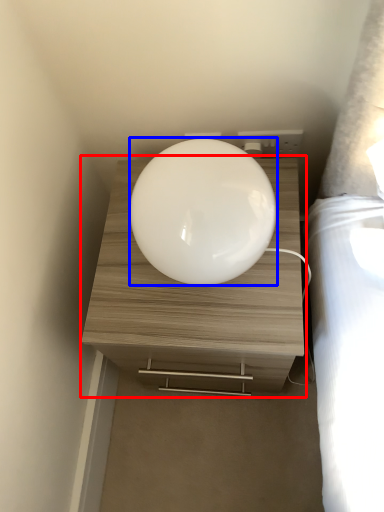
Question: Which point is further to the camera, nightstand (highlighted by a red box) or oval (highlighted by a blue box)?

Choices:
 (A) nightstand
 (B) oval

Answer: (A)